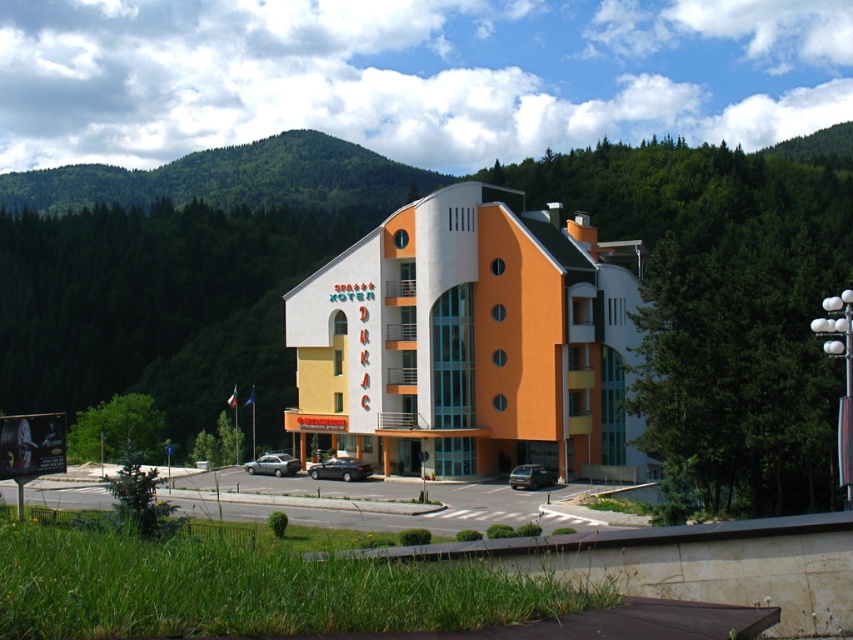
Which is below, orange matte building at center or satin black sedan at center?

satin black sedan at center

Which is behind, point (619, 406) or point (355, 460)?

Point (355, 460)

The height and width of the screenshot is (640, 853). Identify the location of orange matte building at center. (471, 340).

Is silver metallic sedan at center positioned at the back of dark gray matte van at lower center?

Yes.

What do you see at coordinates (273, 465) in the screenshot? I see `silver metallic sedan at center` at bounding box center [273, 465].

You are a GUI agent. You are given a task and a screenshot of the screen. Output one action in this format:
    pyautogui.click(x=<x>, y=<y>)
    Task: Click on the silver metallic sedan at center
    This screenshot has height=640, width=853.
    Given the screenshot: What is the action you would take?
    pyautogui.click(x=273, y=465)

Between point (125, 180) and point (527, 488), which one is positioned behind?

The point (125, 180) is behind.

Does green forested hillside at upper center appear on the right side of dark gray matte van at lower center?

Incorrect, green forested hillside at upper center is not on the right side of dark gray matte van at lower center.

Is point (227, 154) behind point (538, 472)?

That is True.

This screenshot has width=853, height=640. In order to click on green forested hillside at upper center in this screenshot , I will do `click(231, 179)`.